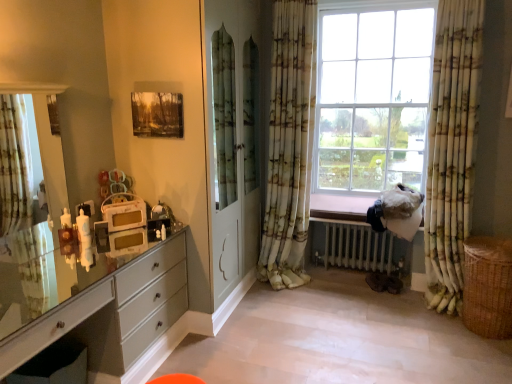
The width and height of the screenshot is (512, 384). Find the location of `vacant space in matte white clock at left (from a real-world perspective)`. vacant space in matte white clock at left (from a real-world perspective) is located at coordinates (125, 233).